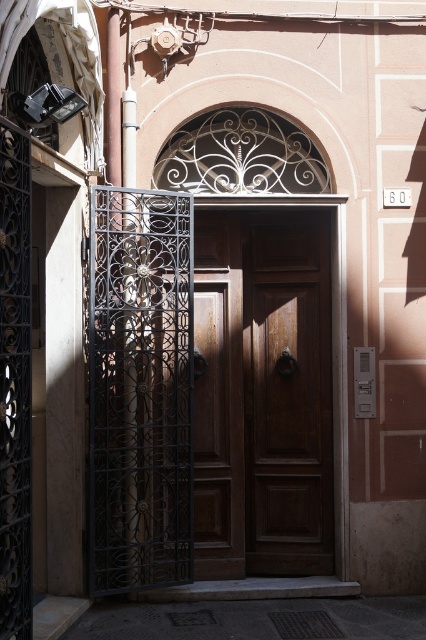
You are standing in front of the building and need to enter. You see the polished wood door at center and the black wrought iron gate at left. Which one is closer to your left side?

The black wrought iron gate at left is closer to your left side since it is positioned to the left of the polished wood door at center.